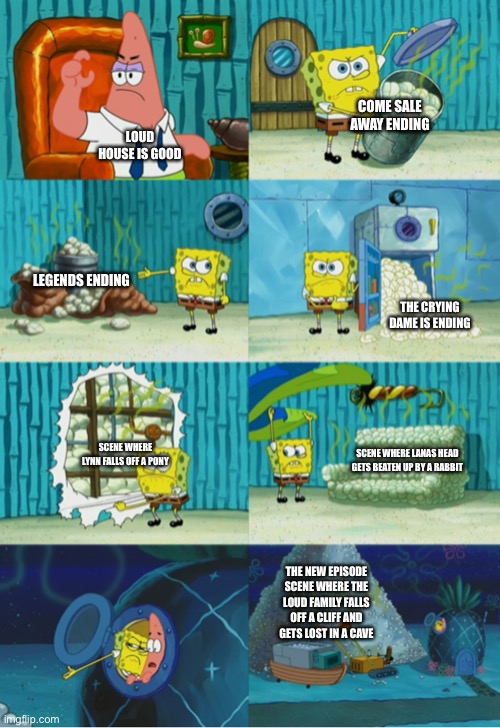
Find the location of a particular element. This screenshot has width=500, height=728. garbage can is located at coordinates (389, 143).